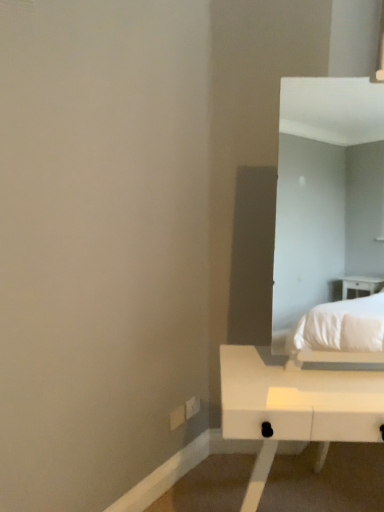
Question: Based on their sizes in the image, would you say white plastic electric outlet at lower center, the 1th electric outlet from the left, is bigger or smaller than white matte table at lower right?

Choices:
 (A) small
 (B) big

Answer: (A)

Question: From a real-world perspective, is white plastic electric outlet at lower center, positioned as the 2th electric outlet in right-to-left order, above or below white matte table at lower right?

Choices:
 (A) below
 (B) above

Answer: (A)

Question: Estimate the real-world distances between objects in this image. Which object is farther from the white plastic electric outlet at lower center, marked as the 2th electric outlet in a left-to-right arrangement?

Choices:
 (A) white matte table at lower right
 (B) white plastic electric outlet at lower center, positioned as the 2th electric outlet in right-to-left order

Answer: (A)

Question: Estimate the real-world distances between objects in this image. Which object is farther from the white plastic electric outlet at lower center, the 1th electric outlet from the left?

Choices:
 (A) white plastic electric outlet at lower center, marked as the 2th electric outlet in a left-to-right arrangement
 (B) white matte table at lower right

Answer: (B)